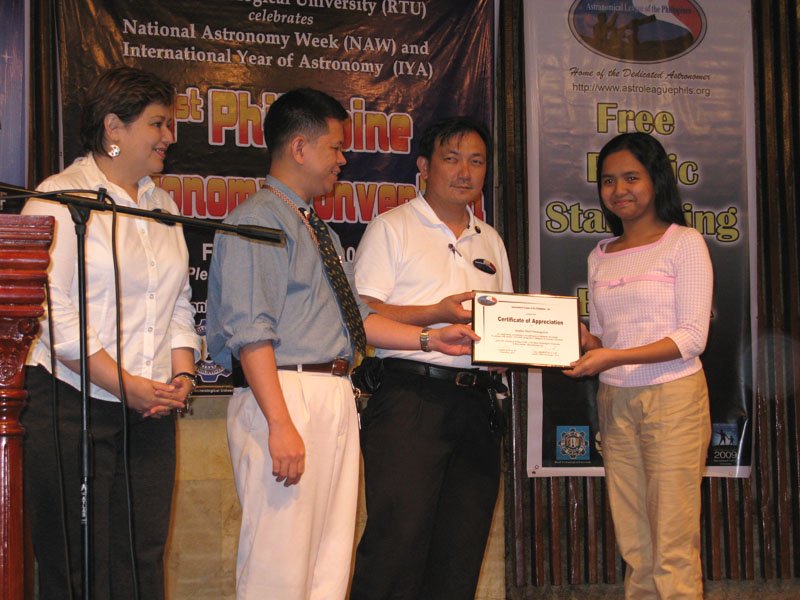
The image size is (800, 600). In order to click on poster in this screenshot , I will do `click(726, 431)`.